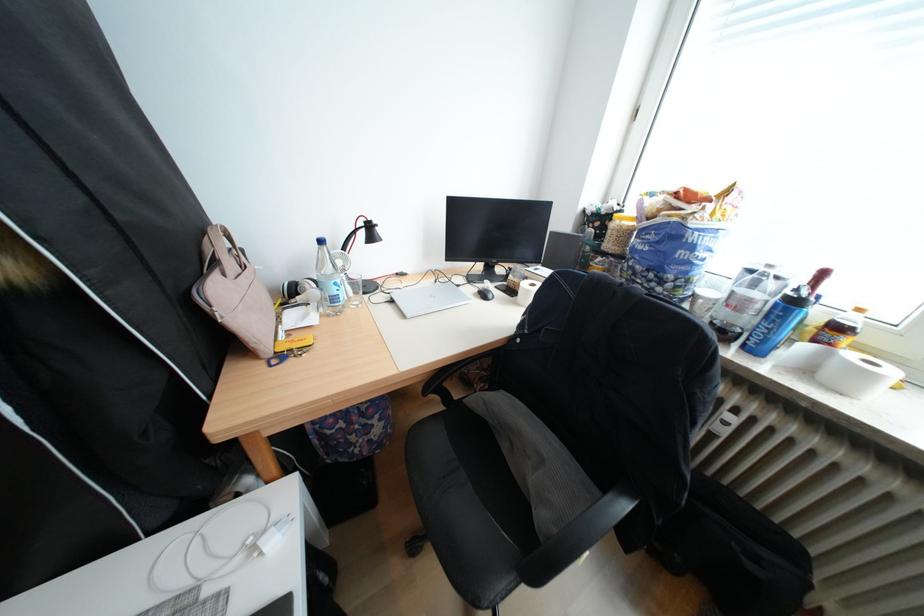
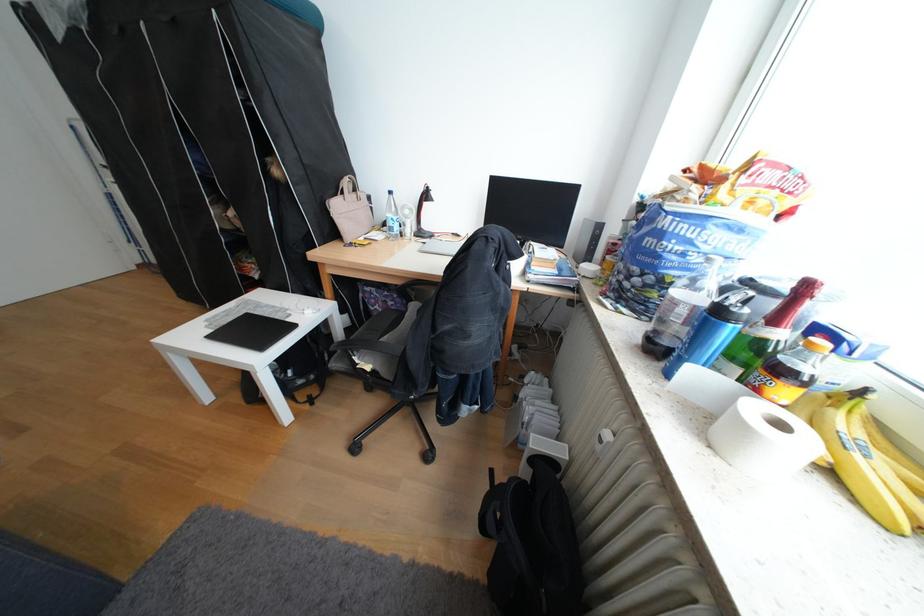
Question: The first image is from the beginning of the video and the second image is from the end. How did the camera likely rotate when shooting the video?

Choices:
 (A) Left
 (B) Right
 (C) Up
 (D) Down

Answer: (A)